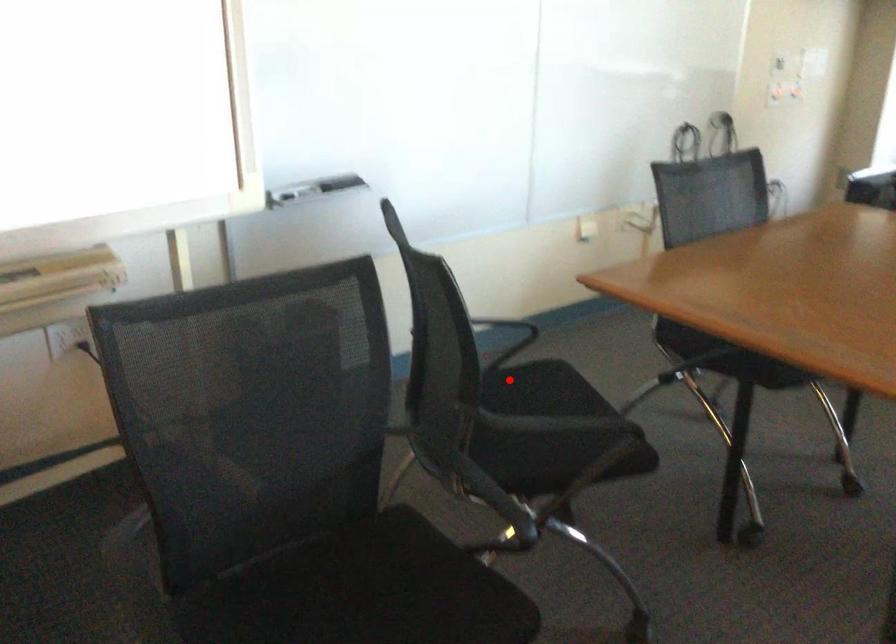
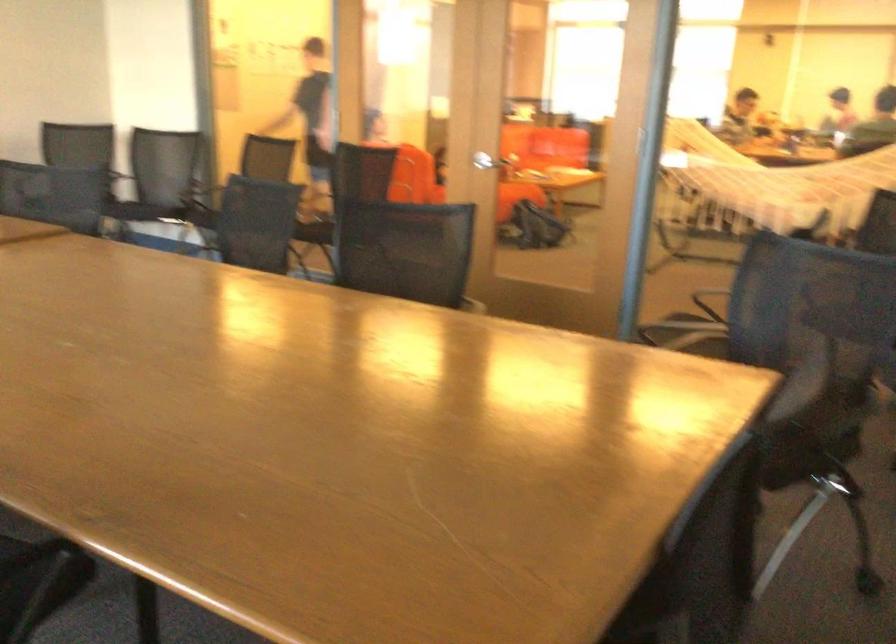
Locate, in the second image, the point that corresponds to the highlighted location in the first image.

(803, 453)